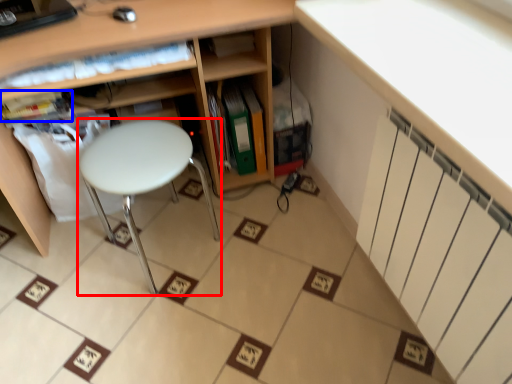
Question: Which object appears farthest to the camera in this image, stool (highlighted by a red box) or book (highlighted by a blue box)?

Choices:
 (A) stool
 (B) book

Answer: (B)